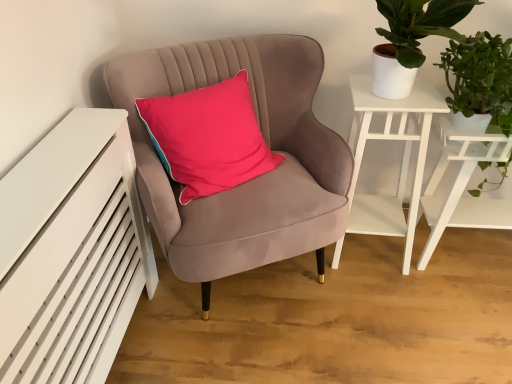
At what (x,y) coordinates should I click in order to perform the action: click on green leafy plant at upper right. Please return your answer as a coordinate pair (x, y). The height and width of the screenshot is (384, 512). Looking at the image, I should click on click(481, 79).

Identify the location of white matte side table at upper right. point(402,157).

What do you see at coordinates (402, 157) in the screenshot?
I see `white matte side table at upper right` at bounding box center [402, 157].

Describe the element at coordinates (252, 179) in the screenshot. The image size is (512, 384). I see `velvet pink chair at center` at that location.

Image resolution: width=512 pixels, height=384 pixels. I want to click on velvet pink chair at center, so click(x=252, y=179).

At what (x,y) coordinates should I click in order to perform the action: click on green leafy plant at upper right. Please return your answer as a coordinate pair (x, y). Looking at the image, I should click on (481, 79).

Is there a large distance between velvet pink chair at center and white matte table at right?

No.

How many degrees apart are the facing directions of velvet pink chair at center and white matte table at right?

They differ by 24.8 degrees in their facing directions.

From a real-world perspective, which object stands above the other?

In real-world perspective, velvet pink chair at center is above.

Considering the sizes of objects velvet pink chair at center and white matte table at right in the image provided, who is shorter, velvet pink chair at center or white matte table at right?

With less height is white matte table at right.

Considering the sizes of green leafy plant at upper right and white matte side table at upper right in the image, is green leafy plant at upper right taller or shorter than white matte side table at upper right?

green leafy plant at upper right is shorter than white matte side table at upper right.

Is green leafy plant at upper right looking in the opposite direction of white matte side table at upper right?

No, green leafy plant at upper right is not facing away from white matte side table at upper right.

Can white matte side table at upper right be found inside green leafy plant at upper right?

No, white matte side table at upper right is located outside of green leafy plant at upper right.

Considering the positions of objects green leafy plant at upper right and white matte side table at upper right in the image provided, who is more to the left, green leafy plant at upper right or white matte side table at upper right?

white matte side table at upper right.

I want to click on nightstand that appears on the right of velvet pink chair at center, so pyautogui.click(x=402, y=157).

Is point (257, 235) closer or farther from the camera than point (351, 91)?

Point (257, 235) is positioned closer to the camera compared to point (351, 91).

Would you say velvet pink chair at center is inside or outside white matte side table at upper right?

velvet pink chair at center is located beyond the bounds of white matte side table at upper right.

Considering the relative positions of white matte table at right and white matte side table at upper right in the image provided, is white matte table at right to the left of white matte side table at upper right from the viewer's perspective?

Incorrect, white matte table at right is not on the left side of white matte side table at upper right.

Does white matte table at right have a smaller size compared to white matte side table at upper right?

Incorrect, white matte table at right is not smaller in size than white matte side table at upper right.

Is white matte table at right with white matte side table at upper right?

No, white matte table at right is not in contact with white matte side table at upper right.

From the image's perspective, does white matte table at right appear higher than velvet pink chair at center?

No, from the image's perspective, white matte table at right is not over velvet pink chair at center.

Considering the sizes of objects white matte table at right and velvet pink chair at center in the image provided, who is wider, white matte table at right or velvet pink chair at center?

velvet pink chair at center.

Which is more distant, [442,154] or [260,51]?

The point [442,154] is farther.

What's the angular difference between green leafy plant at upper right and white matte table at right's facing directions?

The angular difference between green leafy plant at upper right and white matte table at right is 4.15 degrees.

Which of these two, green leafy plant at upper right or white matte table at right, is bigger?

With larger size is white matte table at right.

Between green leafy plant at upper right and white matte table at right, which one has more height?

Standing taller between the two is white matte table at right.

Which of these two, green leafy plant at upper right or white matte table at right, is wider?

Wider between the two is green leafy plant at upper right.

Identify the location of table beneath the green leafy plant at upper right (from a real-world perspective). click(x=463, y=186).

Is white matte table at right positioned with its back to green leafy plant at upper right?

No.

Does white matte table at right have a greater height compared to green leafy plant at upper right?

Yes, white matte table at right is taller than green leafy plant at upper right.

Is white matte table at right to the right of green leafy plant at upper right from the viewer's perspective?

Correct, you'll find white matte table at right to the right of green leafy plant at upper right.

Locate an element on the screen. This screenshot has width=512, height=384. table that appears on the right of velvet pink chair at center is located at coordinates (463, 186).

Identify the location of houseplant in front of the white matte side table at upper right. The image size is (512, 384). (481, 79).

When comparing their distances from green leafy plant at upper right, does velvet pink chair at center or white matte side table at upper right seem further?

velvet pink chair at center is further to green leafy plant at upper right.

Which object lies nearer to the anchor point white matte side table at upper right, white matte table at right or velvet pink chair at center?

Based on the image, white matte table at right appears to be nearer to white matte side table at upper right.

When comparing their distances from velvet pink chair at center, does white matte table at right or white matte side table at upper right seem further?

white matte table at right is further to velvet pink chair at center.

Looking at the image, which one is located further to green leafy plant at upper right, white matte side table at upper right or white matte table at right?

white matte side table at upper right.

When comparing their distances from white matte table at right, does white matte side table at upper right or green leafy plant at upper right seem closer?

The object closer to white matte table at right is white matte side table at upper right.

Looking at the image, which one is located closer to green leafy plant at upper right, white matte table at right or velvet pink chair at center?

Among the two, white matte table at right is located nearer to green leafy plant at upper right.

Considering their positions, is white matte side table at upper right positioned closer to white matte table at right than velvet pink chair at center?

Among the two, white matte side table at upper right is located nearer to white matte table at right.

Based on the photo, looking at the image, which one is located further to white matte table at right, velvet pink chair at center or green leafy plant at upper right?

velvet pink chair at center is further to white matte table at right.

The image size is (512, 384). What are the coordinates of `houseplant situated between velvet pink chair at center and white matte table at right from left to right` in the screenshot? It's located at (481, 79).

At what (x,y) coordinates should I click in order to perform the action: click on houseplant between white matte side table at upper right and white matte table at right. Please return your answer as a coordinate pair (x, y). The width and height of the screenshot is (512, 384). Looking at the image, I should click on (481, 79).

Image resolution: width=512 pixels, height=384 pixels. Identify the location of nightstand between velvet pink chair at center and white matte table at right from left to right. (402, 157).

Where is `nightstand located between velvet pink chair at center and green leafy plant at upper right in the left-right direction`? Image resolution: width=512 pixels, height=384 pixels. nightstand located between velvet pink chair at center and green leafy plant at upper right in the left-right direction is located at coordinates (402, 157).